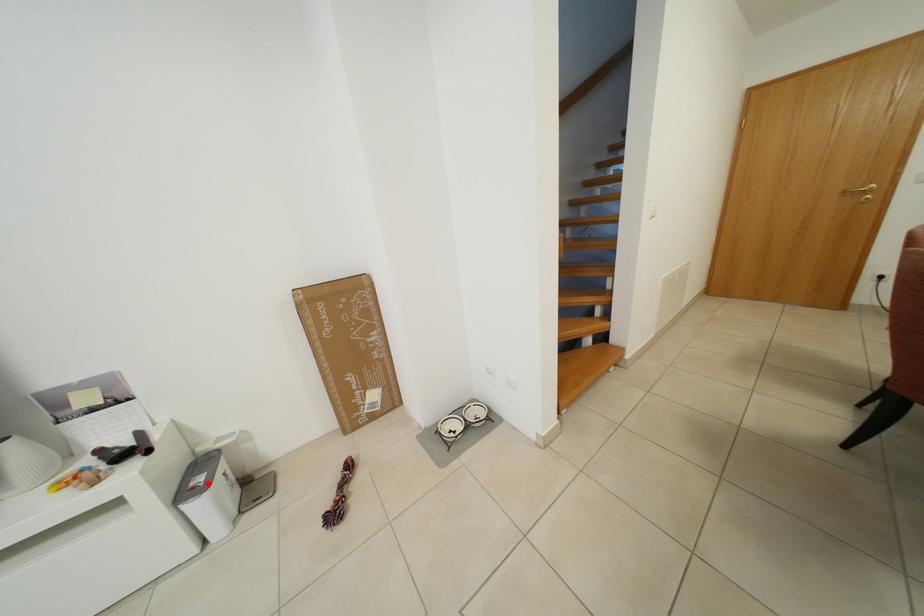
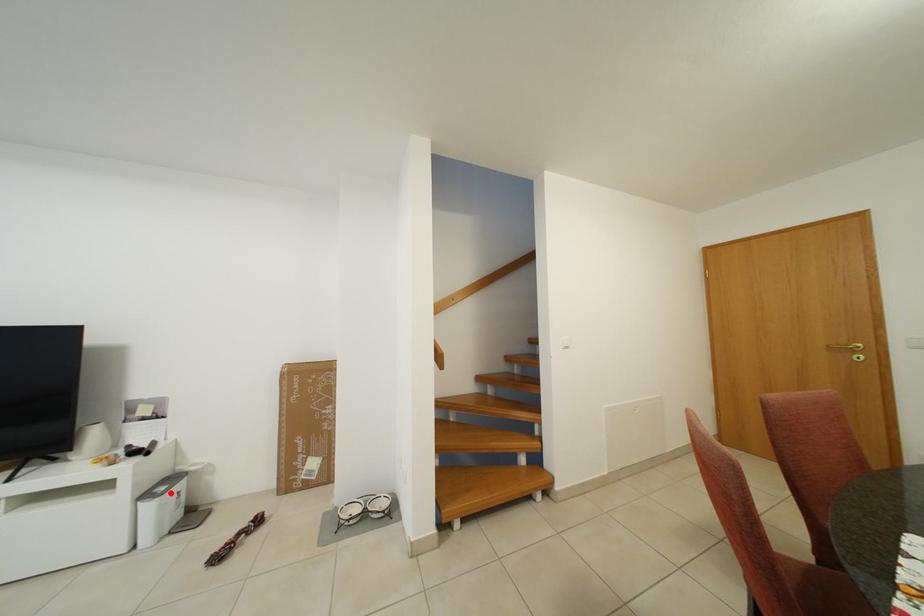
I am providing you with two images of the same scene from different viewpoints. A red point is marked on the first image and another point is marked on the second image. Is the red point in image1 aligned with the point shown in image2?

Yes